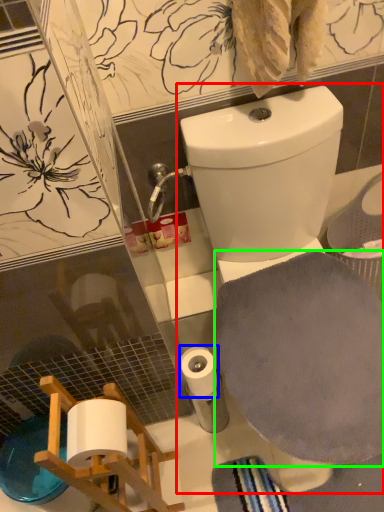
Question: Which is nearer to the toilet (highlighted by a red box)? toilet paper (highlighted by a blue box) or bath towel (highlighted by a green box).

Choices:
 (A) toilet paper
 (B) bath towel

Answer: (B)